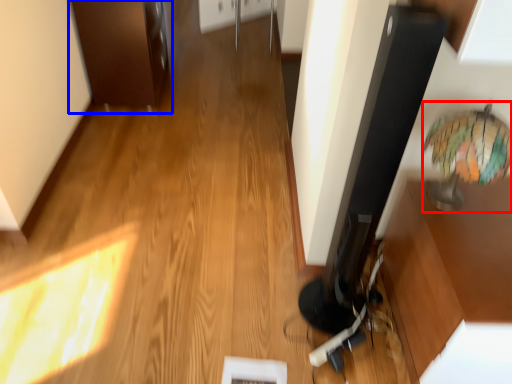
Question: Which object appears farthest to the camera in this image, table lamp (highlighted by a red box) or cabinetry (highlighted by a blue box)?

Choices:
 (A) table lamp
 (B) cabinetry

Answer: (B)